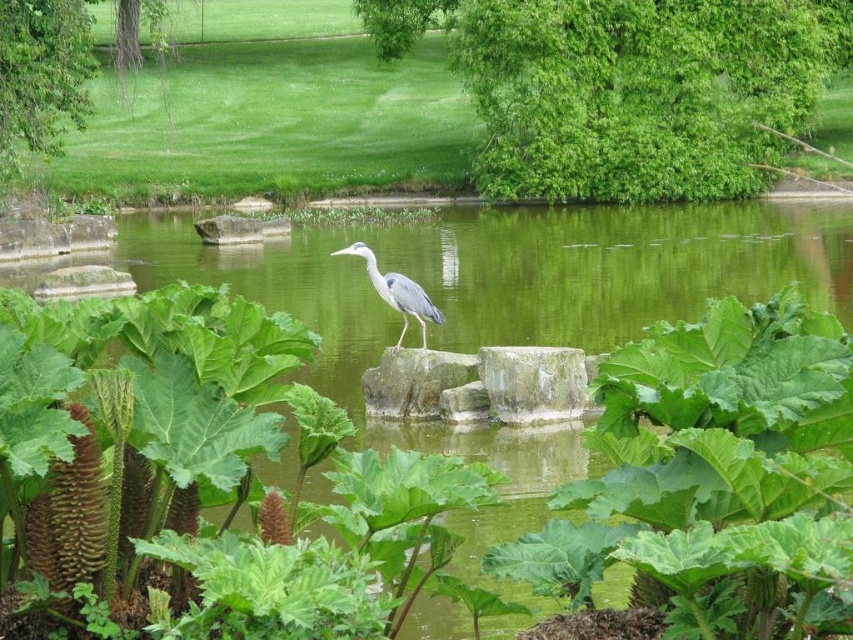
Measure the distance between point (817, 65) and camera.

43.29 meters

Does point (599, 157) come closer to viewer compared to point (413, 316)?

That is False.

Which is behind, point (525, 106) or point (390, 305)?

The point (525, 106) is more distant.

Find the location of a particular element. The image size is (853, 640). green leafy tree at upper center is located at coordinates (627, 88).